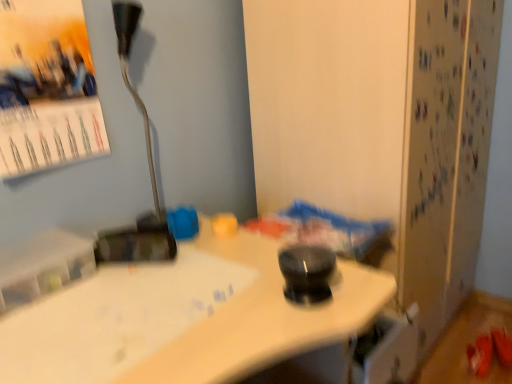
The image size is (512, 384). What do you see at coordinates (149, 171) in the screenshot? I see `metallic silver lamp at upper left` at bounding box center [149, 171].

Measure the distance between metallic silver lamp at upper left and camera.

metallic silver lamp at upper left and camera are 3.64 feet apart from each other.

The width and height of the screenshot is (512, 384). Identify the location of metallic silver lamp at upper left. (149, 171).

At what (x,y) coordinates should I click in order to perform the action: click on matte paper poster at upper left. Please return your answer as a coordinate pair (x, y). This screenshot has height=384, width=512. Looking at the image, I should click on (46, 87).

Image resolution: width=512 pixels, height=384 pixels. What do you see at coordinates (46, 87) in the screenshot? I see `matte paper poster at upper left` at bounding box center [46, 87].

I want to click on metallic silver lamp at upper left, so click(149, 171).

Considering the relative positions of matte paper poster at upper left and metallic silver lamp at upper left in the image provided, is matte paper poster at upper left to the right of metallic silver lamp at upper left from the viewer's perspective?

Incorrect, matte paper poster at upper left is not on the right side of metallic silver lamp at upper left.

Consider the image. Which is behind, matte paper poster at upper left or metallic silver lamp at upper left?

metallic silver lamp at upper left is more distant.

Between point (66, 133) and point (126, 17), which one is positioned in front?

Point (126, 17)

From the image's perspective, is matte paper poster at upper left above or below metallic silver lamp at upper left?

matte paper poster at upper left is above metallic silver lamp at upper left.

From a real-world perspective, does matte paper poster at upper left stand above metallic silver lamp at upper left?

Correct, in the physical world, matte paper poster at upper left is higher than metallic silver lamp at upper left.

Which of these two, matte paper poster at upper left or metallic silver lamp at upper left, is thinner?

matte paper poster at upper left.

In terms of height, does matte paper poster at upper left look taller or shorter compared to metallic silver lamp at upper left?

Clearly, matte paper poster at upper left is shorter compared to metallic silver lamp at upper left.

Which of these two, matte paper poster at upper left or metallic silver lamp at upper left, is smaller?

Smaller between the two is metallic silver lamp at upper left.

Is matte paper poster at upper left completely or partially outside of metallic silver lamp at upper left?

Indeed, matte paper poster at upper left is completely outside metallic silver lamp at upper left.

Is matte paper poster at upper left placed right next to metallic silver lamp at upper left?

matte paper poster at upper left and metallic silver lamp at upper left are not in contact.

Is matte paper poster at upper left oriented away from metallic silver lamp at upper left?

No.

Can you tell me how much matte paper poster at upper left and metallic silver lamp at upper left differ in facing direction?

15.9 degrees.

Locate an element on the screen. This screenshot has height=384, width=512. poster page that is on the left side of metallic silver lamp at upper left is located at coordinates (46, 87).

Visually, is metallic silver lamp at upper left positioned to the left or to the right of matte paper poster at upper left?

Clearly, metallic silver lamp at upper left is on the right of matte paper poster at upper left in the image.

Is metallic silver lamp at upper left in front of or behind matte paper poster at upper left in the image?

Clearly, metallic silver lamp at upper left is behind matte paper poster at upper left.

Is point (145, 240) closer or farther from the camera than point (91, 106)?

Point (145, 240) is positioned closer to the camera compared to point (91, 106).

In the scene shown: From the image's perspective, which is above, metallic silver lamp at upper left or matte paper poster at upper left?

matte paper poster at upper left is shown above in the image.

From the picture: From a real-world perspective, between metallic silver lamp at upper left and matte paper poster at upper left, who is vertically higher?

matte paper poster at upper left.

Can you confirm if metallic silver lamp at upper left is thinner than matte paper poster at upper left?

No.

Considering the sizes of objects metallic silver lamp at upper left and matte paper poster at upper left in the image provided, who is shorter, metallic silver lamp at upper left or matte paper poster at upper left?

matte paper poster at upper left.

Who is bigger, metallic silver lamp at upper left or matte paper poster at upper left?

matte paper poster at upper left is bigger.

Is metallic silver lamp at upper left surrounding matte paper poster at upper left?

No.

Can you see metallic silver lamp at upper left touching matte paper poster at upper left?

metallic silver lamp at upper left is not next to matte paper poster at upper left, and they're not touching.

Could you tell me if metallic silver lamp at upper left is turned towards matte paper poster at upper left?

No.

Can you tell me how much metallic silver lamp at upper left and matte paper poster at upper left differ in facing direction?

There is a 15.9-degree angle between the facing directions of metallic silver lamp at upper left and matte paper poster at upper left.

How distant is metallic silver lamp at upper left from matte paper poster at upper left?

metallic silver lamp at upper left is 23.02 centimeters from matte paper poster at upper left.

Image resolution: width=512 pixels, height=384 pixels. What are the coordinates of `poster page that appears above the metallic silver lamp at upper left (from a real-world perspective)` in the screenshot? It's located at (46, 87).

At what (x,y) coordinates should I click in order to perform the action: click on poster page in front of the metallic silver lamp at upper left. Please return your answer as a coordinate pair (x, y). This screenshot has height=384, width=512. Looking at the image, I should click on (46, 87).

Image resolution: width=512 pixels, height=384 pixels. In order to click on lamp below the matte paper poster at upper left (from the image's perspective) in this screenshot , I will do `click(149, 171)`.